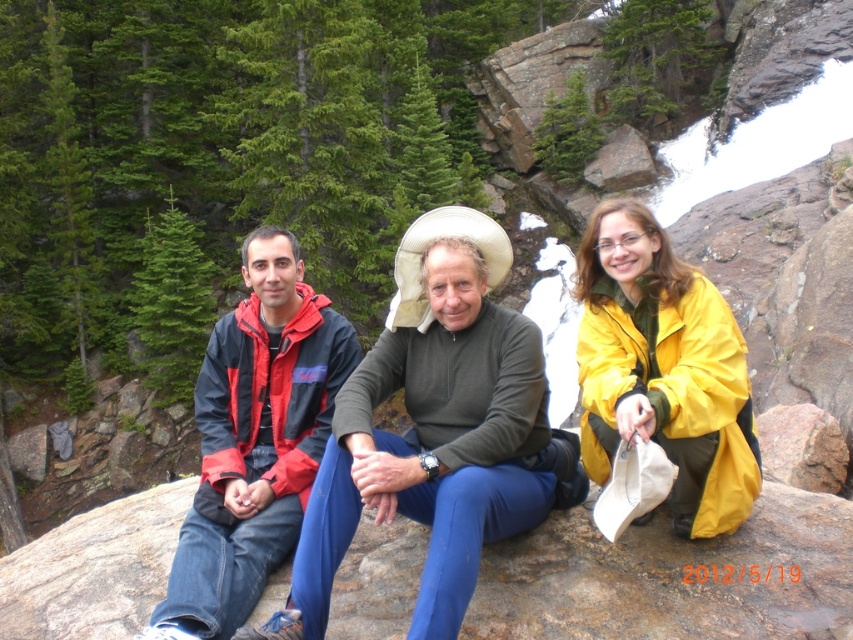
Question: Among these points, which one is farthest from the camera?

Choices:
 (A) (466, 483)
 (B) (657, 604)
 (C) (679, 259)
 (D) (196, 394)

Answer: (C)

Question: Does smooth granite boulder at center appear on the right side of yellow matte jacket at center?

Choices:
 (A) yes
 (B) no

Answer: (B)

Question: Does smooth granite boulder at center have a greater width compared to red jacket at center?

Choices:
 (A) no
 (B) yes

Answer: (A)

Question: Is red jacket at center in front of yellow matte jacket at center?

Choices:
 (A) no
 (B) yes

Answer: (B)

Question: Which point is farther to the camera?

Choices:
 (A) (305, 376)
 (B) (61, 592)
 (C) (467, 294)

Answer: (A)

Question: Among these objects, which one is nearest to the camera?

Choices:
 (A) red and black jacket at left
 (B) smooth granite boulder at center
 (C) yellow matte jacket at center

Answer: (A)